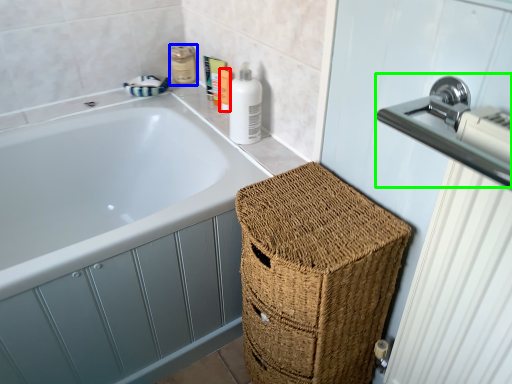
Question: Which object is positioned farthest from toiletry (highlighted by a red box)? Select from toiletry (highlighted by a blue box) and sink (highlighted by a green box).

Choices:
 (A) toiletry
 (B) sink

Answer: (B)